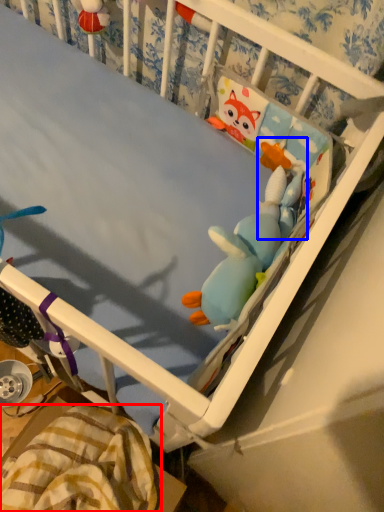
Question: Which object appears farthest to the camera in this image, blanket (highlighted by a red box) or toy (highlighted by a blue box)?

Choices:
 (A) blanket
 (B) toy

Answer: (B)